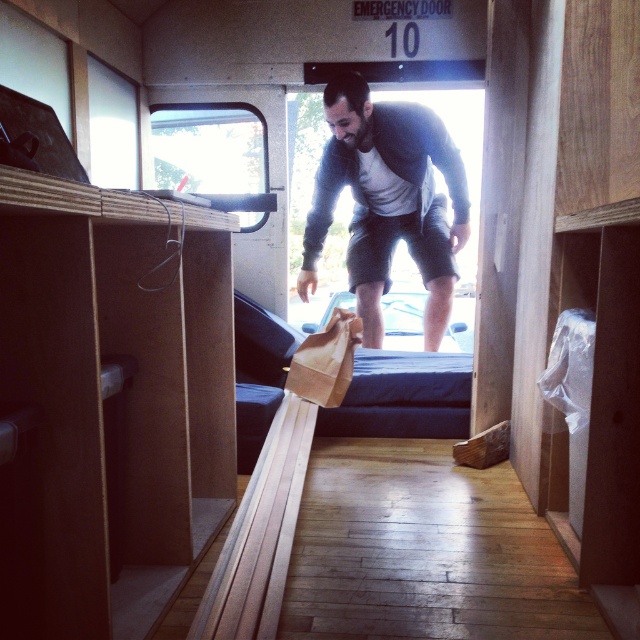
The width and height of the screenshot is (640, 640). I want to click on gray cotton shirt at center, so click(387, 202).

Is gray cotton shirt at center below dark blue fabric bed at center?

No.

Between point (436, 141) and point (387, 435), which one is positioned behind?

The point (387, 435) is behind.

I want to click on gray cotton shirt at center, so click(x=387, y=202).